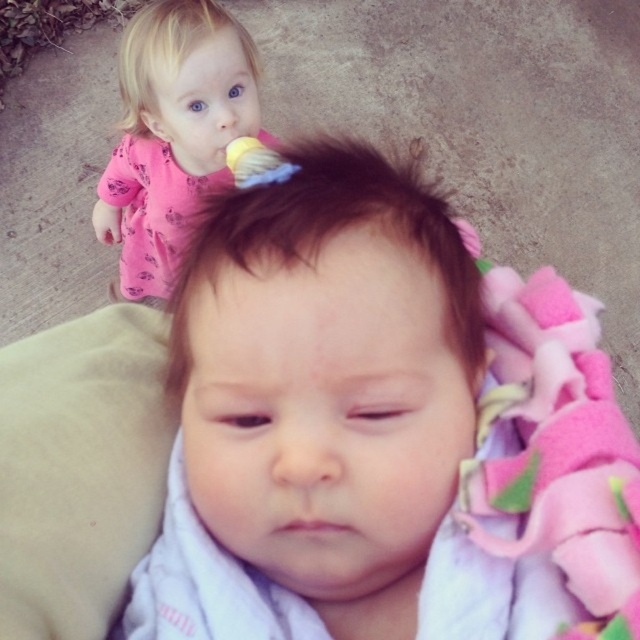
Consider the image. Is soft pink blanket at center to the left of pink fabric at upper left from the viewer's perspective?

In fact, soft pink blanket at center is to the right of pink fabric at upper left.

Is point (397, 589) in front of point (115, 172)?

That is True.

The height and width of the screenshot is (640, 640). Find the location of `soft pink blanket at center`. soft pink blanket at center is located at coordinates (380, 426).